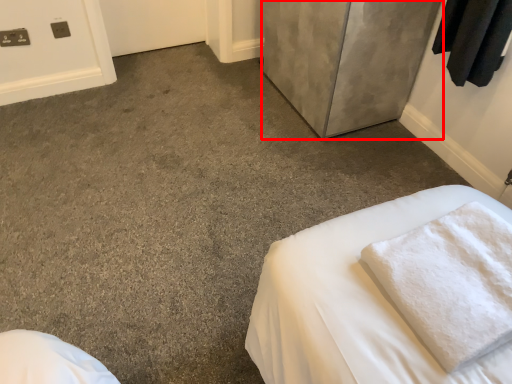
Question: Observing the image, what is the correct spatial positioning of door (annotated by the red box) in reference to bath towel?

Choices:
 (A) left
 (B) right

Answer: (A)